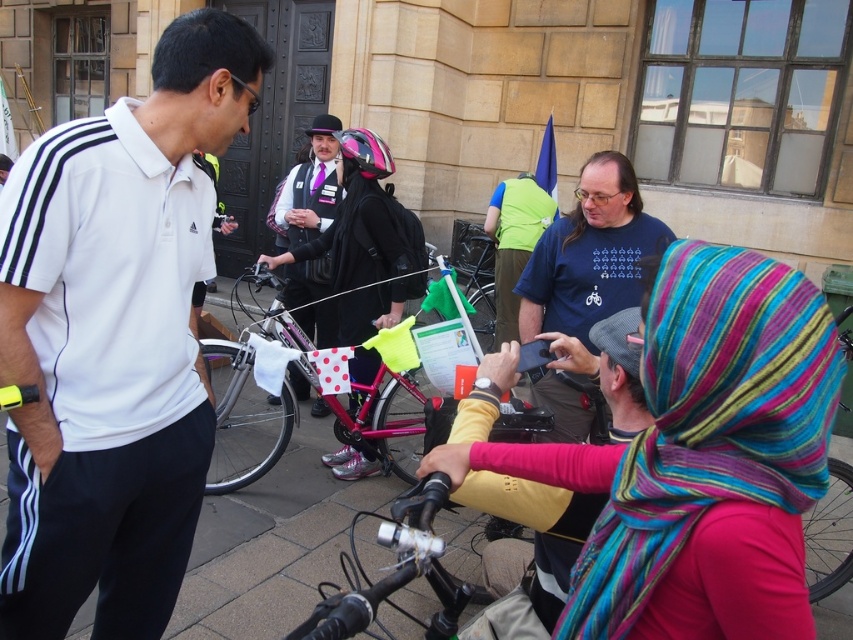
You are standing in the scene and want to take a photo of both the point at coordinates point (88, 452) and point (367, 193). Which point should you focus on first to ensure both are in focus?

You should focus on point (88, 452) first because it is closer to the camera, ensuring that both points will be within the depth of field when focused on the closer point.

You are a photographer trying to capture a photo of the multicolored striped scarf at center and the pink metallic bicycle at center. Based on their heights, which object should you adjust your camera angle to focus on first?

The multicolored striped scarf at center is not as tall as the pink metallic bicycle at center, so you should focus on the pink metallic bicycle at center first to ensure it is fully captured in the frame.

You are organizing a photo shoot and need to place a small prop next to both the white matte polo shirt at left and the pink matte helmet at center. Which object should you place the prop closer to if you want the prop to look proportionally larger in the final image?

You should place the prop closer to the white matte polo shirt at left since it is smaller than the pink matte helmet at center, making the prop appear proportionally larger in comparison.